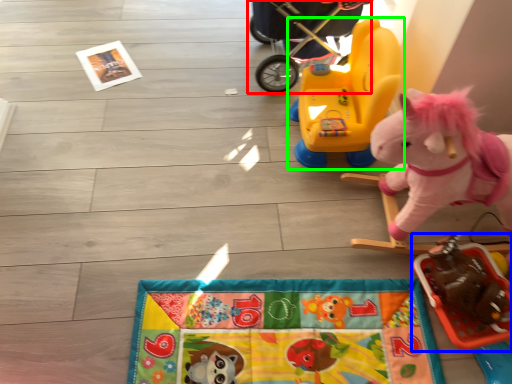
Question: Which is nearer to the baby carriage (highlighted by a red box)? toy (highlighted by a blue box) or toy (highlighted by a green box).

Choices:
 (A) toy
 (B) toy

Answer: (B)